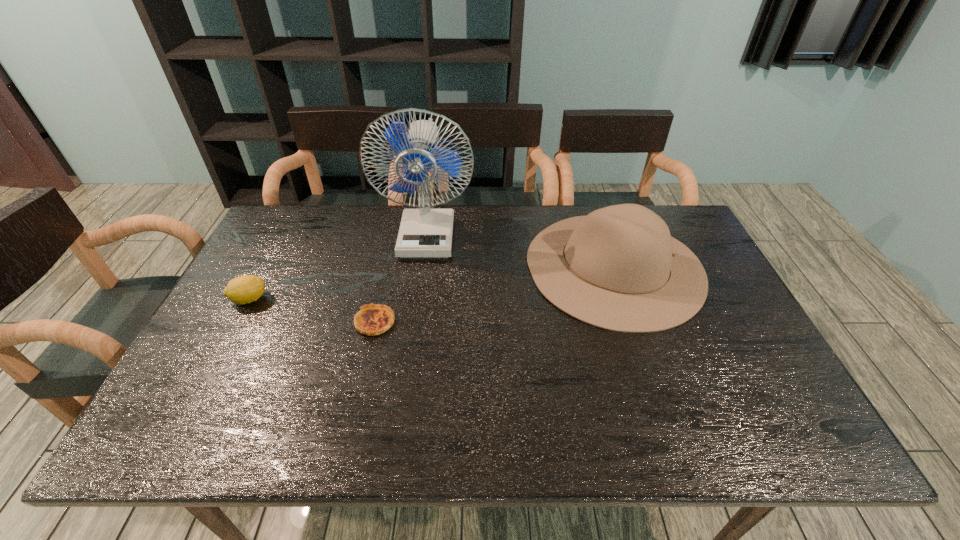
Find the location of a particular element. The width and height of the screenshot is (960, 540). vacant space that is in between the sombrero and the fan is located at coordinates (520, 251).

Where is `vacant region between the quiche and the lemon`? The image size is (960, 540). vacant region between the quiche and the lemon is located at coordinates (312, 310).

Find the location of a particular element. vacant point located between the quiche and the lemon is located at coordinates (312, 310).

You are a GUI agent. You are given a task and a screenshot of the screen. Output one action in this format:
    pyautogui.click(x=<x>, y=<y>)
    Task: Click on the free space between the lemon and the rightmost object
    
    Given the screenshot: What is the action you would take?
    coord(432,283)

In order to click on empty space between the lemon and the sombrero in this screenshot , I will do `click(432, 283)`.

Locate an element on the screen. This screenshot has width=960, height=540. free point between the shortest object and the lemon is located at coordinates (312, 310).

Locate an element on the screen. This screenshot has height=540, width=960. free space between the fan and the sombrero is located at coordinates (520, 251).

The image size is (960, 540). Identify the location of blank region between the shortest object and the leftmost object. (312, 310).

Locate an element on the screen. This screenshot has height=540, width=960. free space between the second shortest object and the tallest object is located at coordinates (338, 267).

Locate an element on the screen. The width and height of the screenshot is (960, 540). free spot between the fan and the third shortest object is located at coordinates (520, 251).